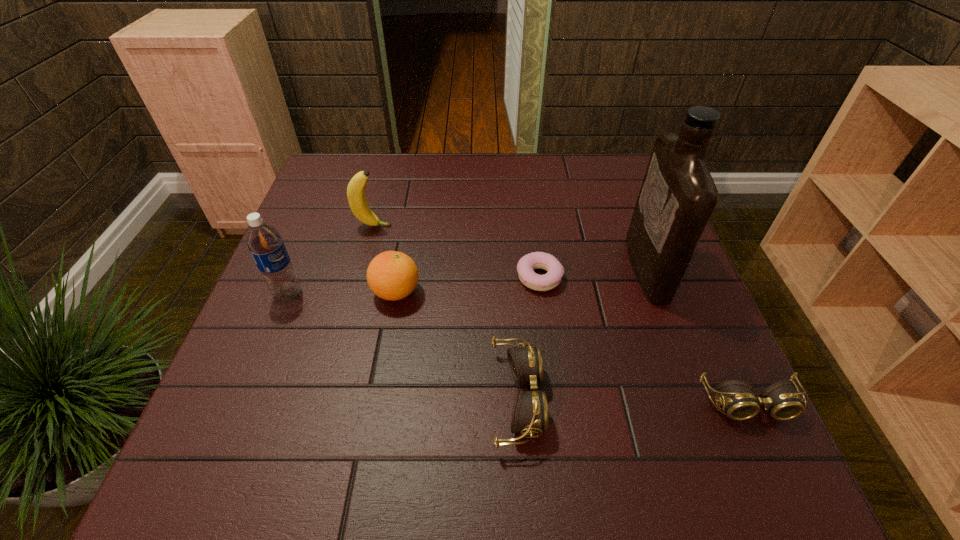
Locate an element on the screen. This screenshot has width=960, height=540. the third shortest object is located at coordinates (530, 415).

You are a GUI agent. You are given a task and a screenshot of the screen. Output one action in this format:
    pyautogui.click(x=<x>, y=<y>)
    Task: Click on the left goggles
    
    Given the screenshot: What is the action you would take?
    pyautogui.click(x=530, y=415)

This screenshot has width=960, height=540. Identify the location of the shorter goggles. (781, 400).

In order to click on the second shortest object in this screenshot , I will do `click(781, 400)`.

You are a GUI agent. You are given a task and a screenshot of the screen. Output one action in this format:
    pyautogui.click(x=<x>, y=<y>)
    Task: Click on the banana
    
    Given the screenshot: What is the action you would take?
    pyautogui.click(x=356, y=196)

Locate an element on the screen. Image resolution: width=960 pixels, height=540 pixels. the fifth shortest object is located at coordinates (356, 196).

Locate an element on the screen. The width and height of the screenshot is (960, 540). orange is located at coordinates pyautogui.click(x=391, y=275).

Locate an element on the screen. Image resolution: width=960 pixels, height=540 pixels. the shortest object is located at coordinates (527, 264).

This screenshot has width=960, height=540. Find the location of `liquor`. liquor is located at coordinates (678, 195).

Find the location of a particular element. The height and width of the screenshot is (540, 960). water bottle is located at coordinates (264, 242).